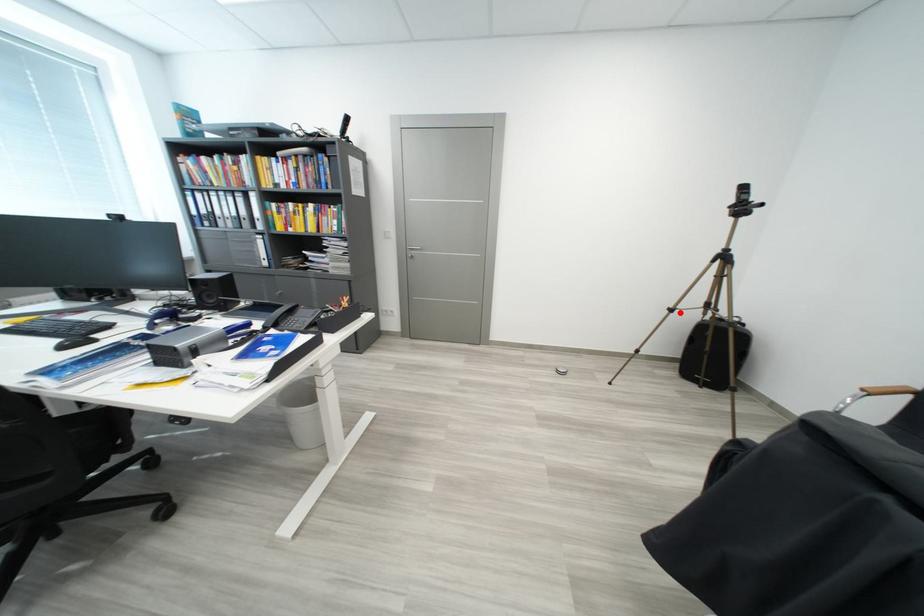
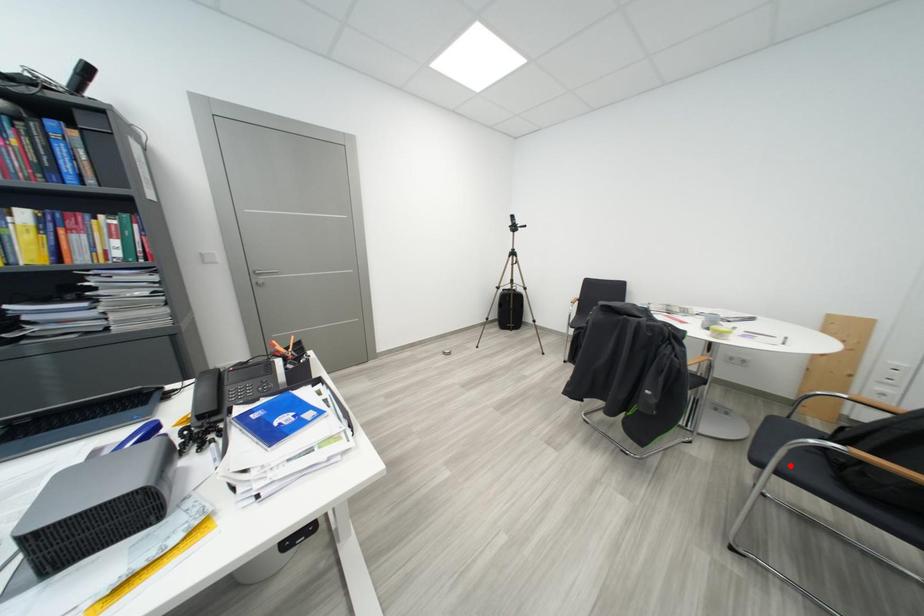
I am providing you with two images of the same scene from different viewpoints. A red point is marked on the first image and another point is marked on the second image. Is the marked point in image1 the same physical position as the marked point in image2?

No